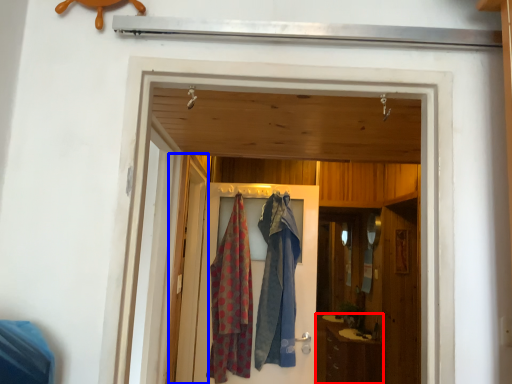
Question: Which of the following is the farthest to the observer, cabinetry (highlighted by a red box) or screen door (highlighted by a blue box)?

Choices:
 (A) cabinetry
 (B) screen door

Answer: (A)